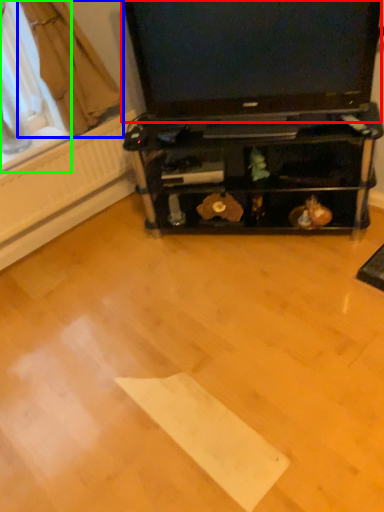
Question: Which is nearer to the television (highlighted by a red box)? curtain (highlighted by a blue box) or window screen (highlighted by a green box).

Choices:
 (A) curtain
 (B) window screen

Answer: (A)